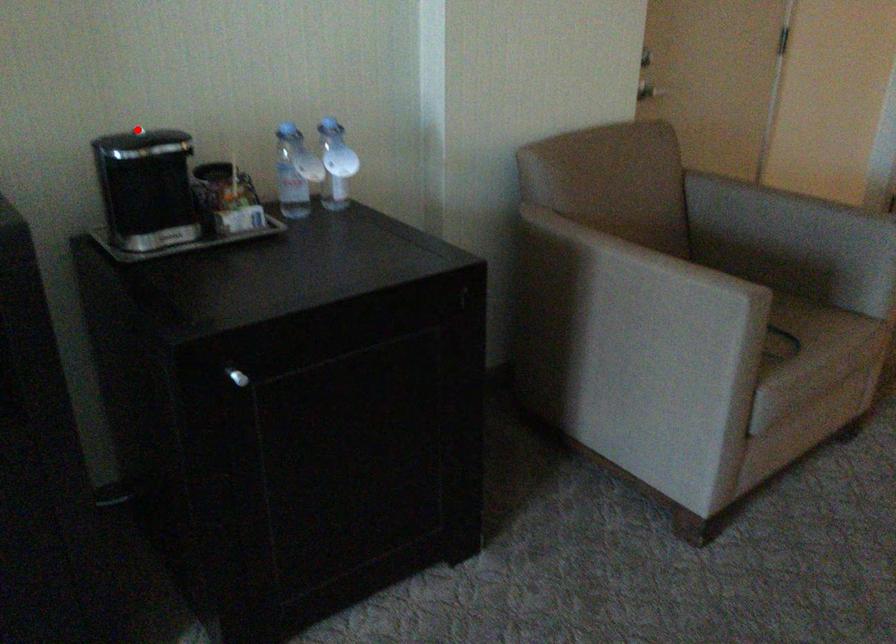
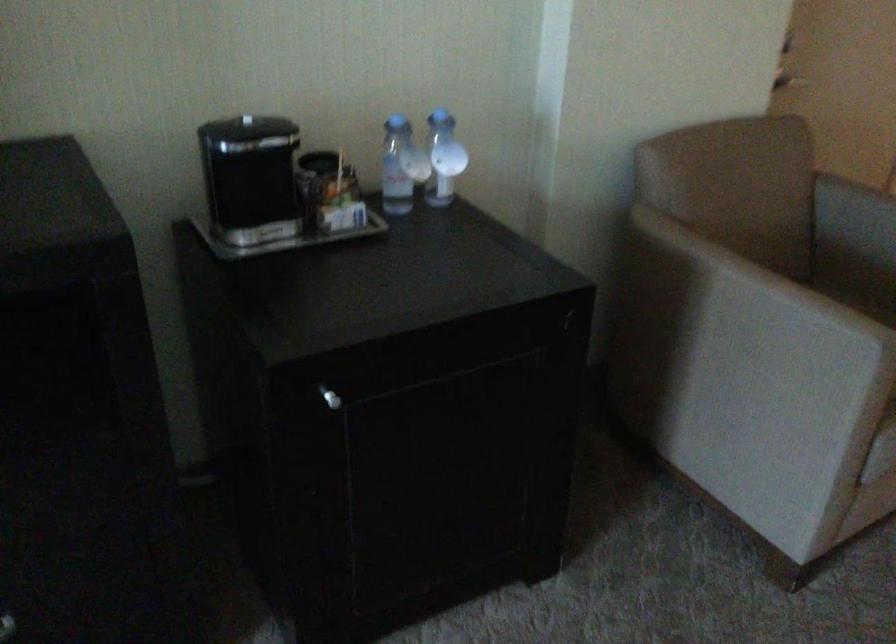
Question: I am providing you with two images of the same scene from different viewpoints. Image1 has a red point marked. In image2, the corresponding 3D location appears at what relative position? Reply with the corresponding letter.

Choices:
 (A) Closer
 (B) Farther

Answer: (A)